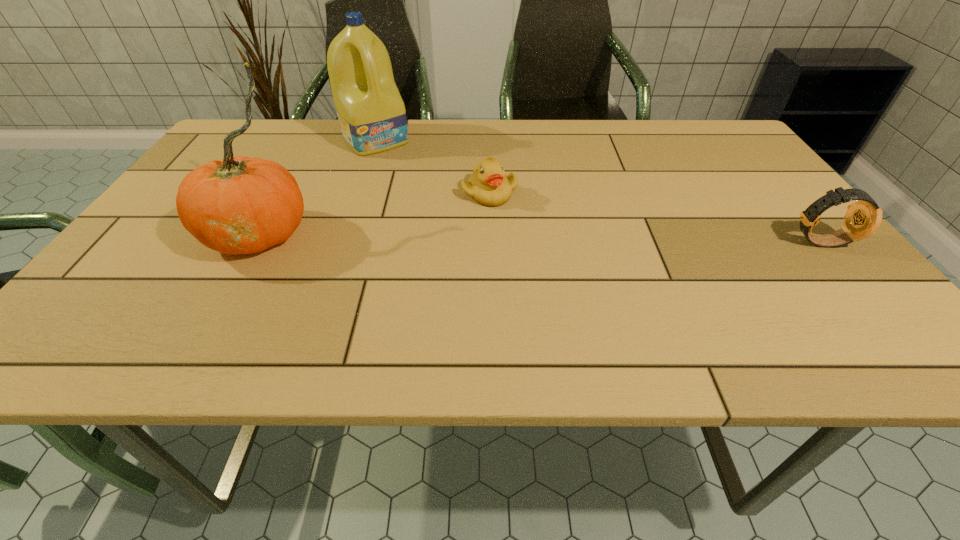
At what (x,y) coordinates should I click in order to perform the action: click on vacant space on the desktop that is between the pumpkin and the watch and is positioned on the label of the detergent. Please return your answer as a coordinate pair (x, y). The width and height of the screenshot is (960, 540). Looking at the image, I should click on (463, 236).

At what (x,y) coordinates should I click in order to perform the action: click on vacant spot on the desktop that is between the pumpkin and the rightmost object and is positioned on the front-facing side of the duckling. Please return your answer as a coordinate pair (x, y). This screenshot has width=960, height=540. Looking at the image, I should click on (552, 238).